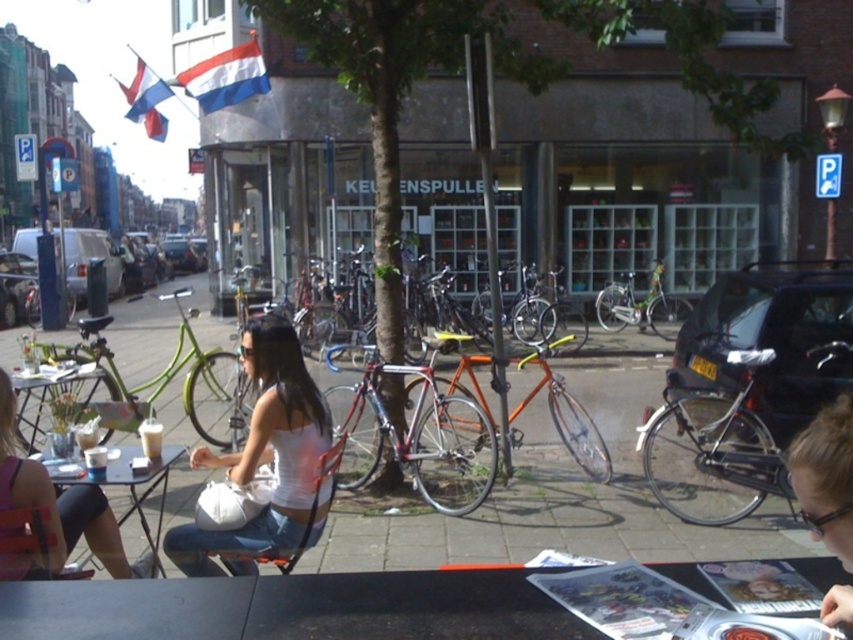
You are standing at the point marked by the coordinates point (161, 381). What object is located at this point?

The point (161, 381) marks the green matte bicycle at left.

You are a delivery person who needs to pick up a package from the table at the center. The green matte bicycle at left is blocking your path. Can you walk around it to reach the matte white tank top at center?

The green matte bicycle at left is further to the viewer than the matte white tank top at center, so you can walk around it to reach the matte white tank top at center.

You are standing at the sidewalk cafe table in the urban scene. There are two points marked on the ground in front of you. One is at coordinate point (241,483) and the other at point (375,433). Which point is closer to you?

Point (241,483) is closer to the viewer than point (375,433).